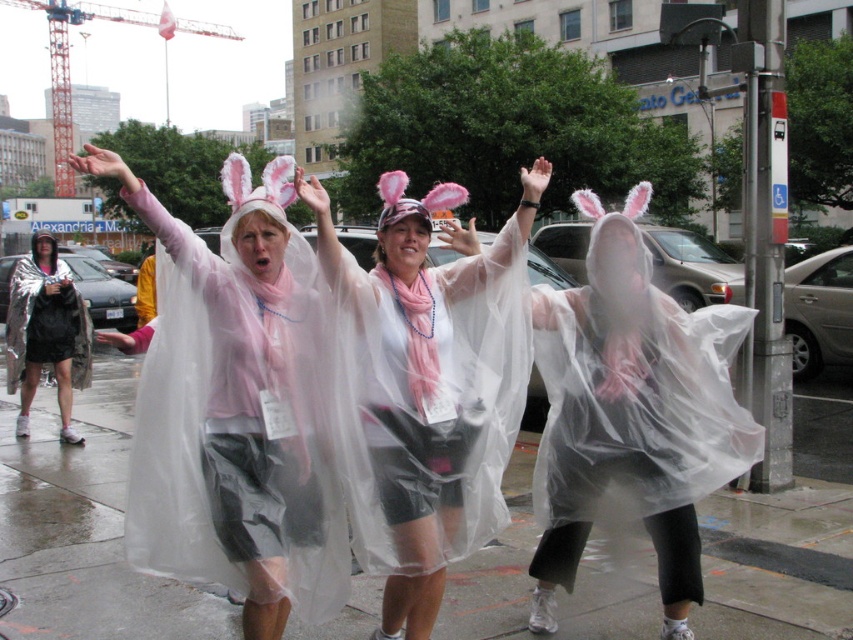
You are a photographer trying to capture a clear shot of both the translucent plastic poncho at center and the metallic silver poncho at left. Since you can only focus on one at a time, which poncho should you focus on first to ensure the other is in the background?

You should focus on the translucent plastic poncho at center first because it is closer to the viewer than the metallic silver poncho at left, so if you focus on it, the metallic silver poncho at left will naturally be in the background and still in focus.

In the scene shown: You are a photographer standing at the camera position. You want to capture a clear photo of the translucent plastic poncho at center. What distance should you set your camera to focus on?

The camera should be focused at 3.14 meters to capture the translucent plastic poncho at center clearly, as they are 3.14 meters apart.

In the scene with three rabbit costumed people, where the transparent plastic rain poncho at lower center and the translucent plastic poncho at center are both present, which one is positioned to the left of the other?

The transparent plastic rain poncho at lower center is positioned to the left of the translucent plastic poncho at center.